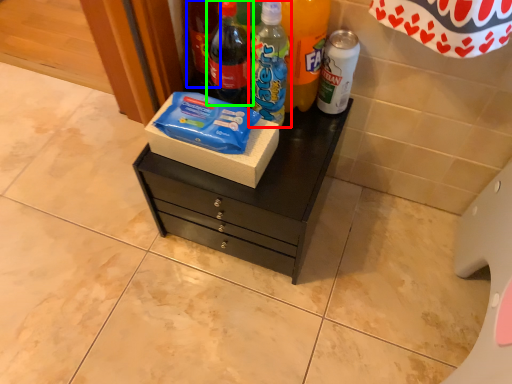
Question: Estimate the real-world distances between objects in this image. Which object is farther from bottle (highlighted by a red box), bottle (highlighted by a blue box) or bottle (highlighted by a green box)?

Choices:
 (A) bottle
 (B) bottle

Answer: (A)